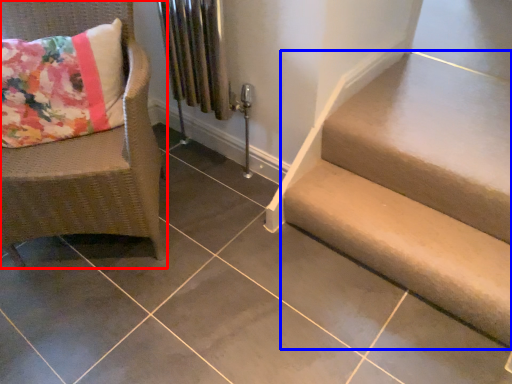
Question: Which point is closer to the camera, chair (highlighted by a red box) or stairs (highlighted by a blue box)?

Choices:
 (A) chair
 (B) stairs

Answer: (A)